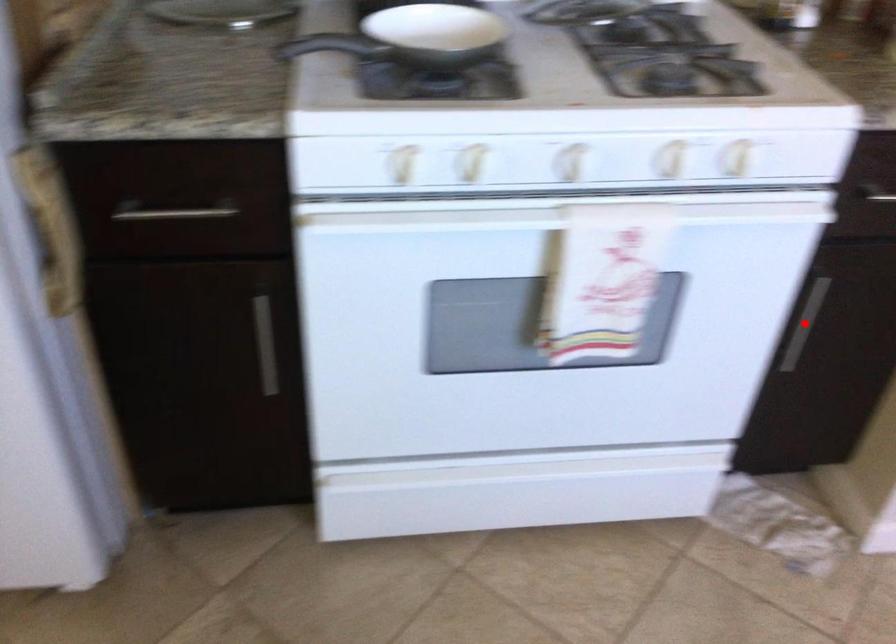
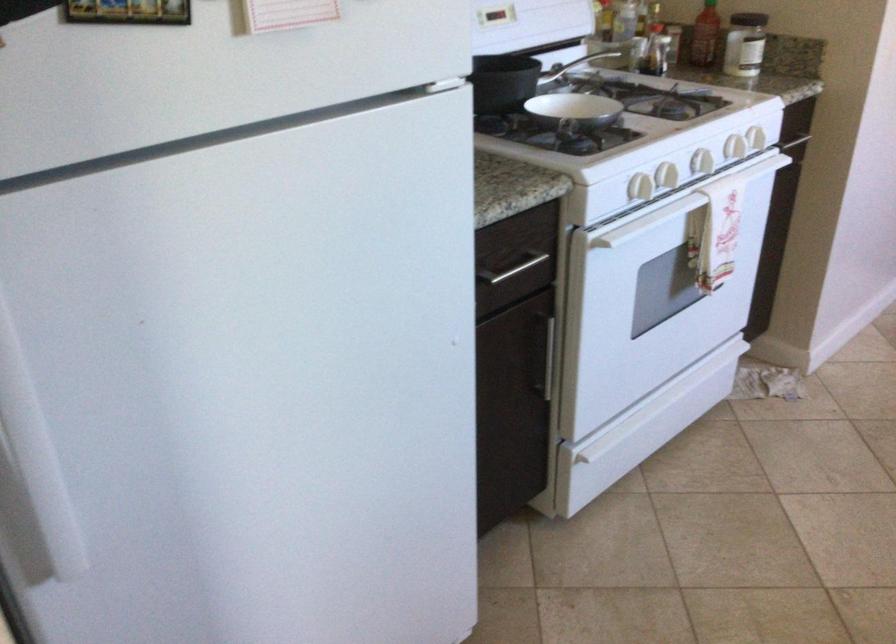
Question: I am providing you with two images of the same scene from different viewpoints. A red point is marked on the first image. Can you still see the location of the red point in image 2?

Choices:
 (A) Yes
 (B) No

Answer: (B)